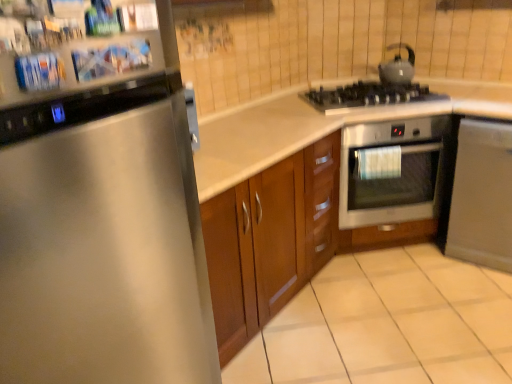
Question: From a real-world perspective, is matte black kettle at upper right above or below stainless steel refrigerator at left?

Choices:
 (A) above
 (B) below

Answer: (A)

Question: Is matte black kettle at upper right inside the boundaries of stainless steel refrigerator at left, or outside?

Choices:
 (A) inside
 (B) outside

Answer: (B)

Question: Estimate the real-world distances between objects in this image. Which object is closer to the black matte gas stove at upper right?

Choices:
 (A) stainless steel refrigerator at left
 (B) stainless steel oven at center-right
 (C) satin silver dishwasher at lower right
 (D) white glossy countertop at center
 (E) matte black kettle at upper right

Answer: (E)

Question: Which object is positioned farthest from the stainless steel refrigerator at left?

Choices:
 (A) black matte gas stove at upper right
 (B) stainless steel oven at center-right
 (C) satin silver dishwasher at lower right
 (D) white glossy countertop at center
 (E) matte black kettle at upper right

Answer: (E)